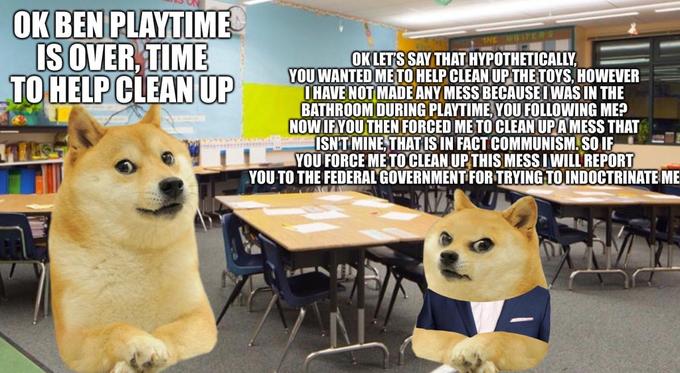
In order to click on chairs in this screenshot , I will do `click(5, 242)`, `click(233, 251)`, `click(273, 277)`, `click(396, 271)`, `click(374, 250)`, `click(579, 234)`, `click(647, 225)`.